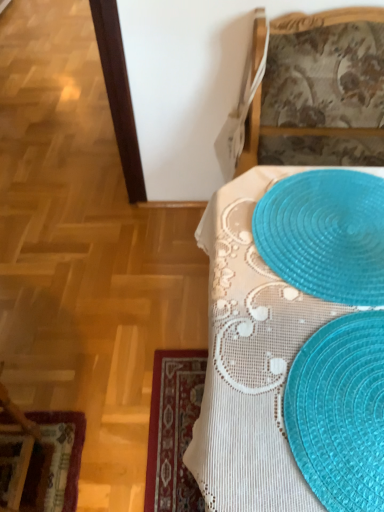
Identify the location of vacant space behind translucent blue placemat at lower right. The width and height of the screenshot is (384, 512). click(x=315, y=261).